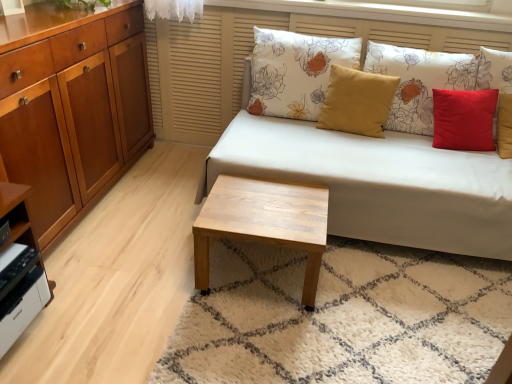
This screenshot has width=512, height=384. I want to click on vacant space situated above light wood/texture coffee table at center (from a real-world perspective), so click(x=270, y=205).